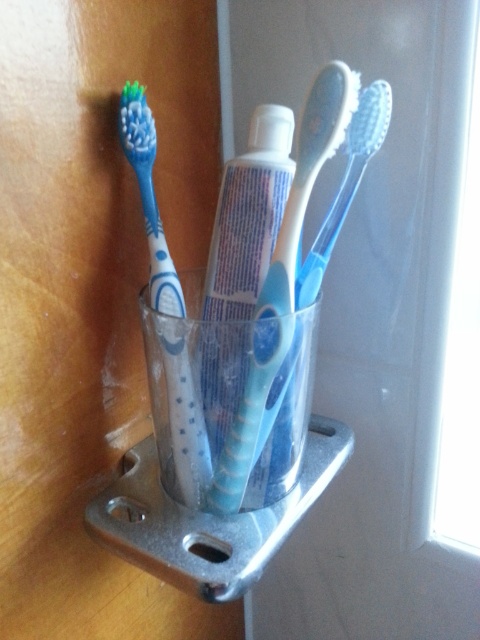
You are organizing your bathroom and want to place a new toothbrush between the blue rubber toothbrush at center and the blue rubber toothbrush at left. Based on their current positions, where should you place the new toothbrush?

The blue rubber toothbrush at center is located below the blue rubber toothbrush at left. Therefore, to place the new toothbrush between them, you should position it above the blue rubber toothbrush at center but below the blue rubber toothbrush at left.

You are organizing the bathroom and want to place a new toothbrush between the blue rubber toothbrush at center and the blue rubber toothbrush at left. Since the new toothbrush is taller than both, where should you place it to maintain the height order from shortest to tallest?

The blue rubber toothbrush at center is not as tall as the blue rubber toothbrush at left, so the new toothbrush should be placed to the right of the blue rubber toothbrush at center to maintain the height order from shortest to tallest.

You are a dentist checking the bathroom setup. You need to place a new toothbrush that is 2 inches long between the blue rubber toothbrush at center and the translucent plastic toothbrush at center. Can the new toothbrush fit in the space between them?

The distance between the blue rubber toothbrush at center and the translucent plastic toothbrush at center is 1.82 inches. Since the new toothbrush is 2 inches long, it cannot fit in the space between them as it is longer than the available distance.